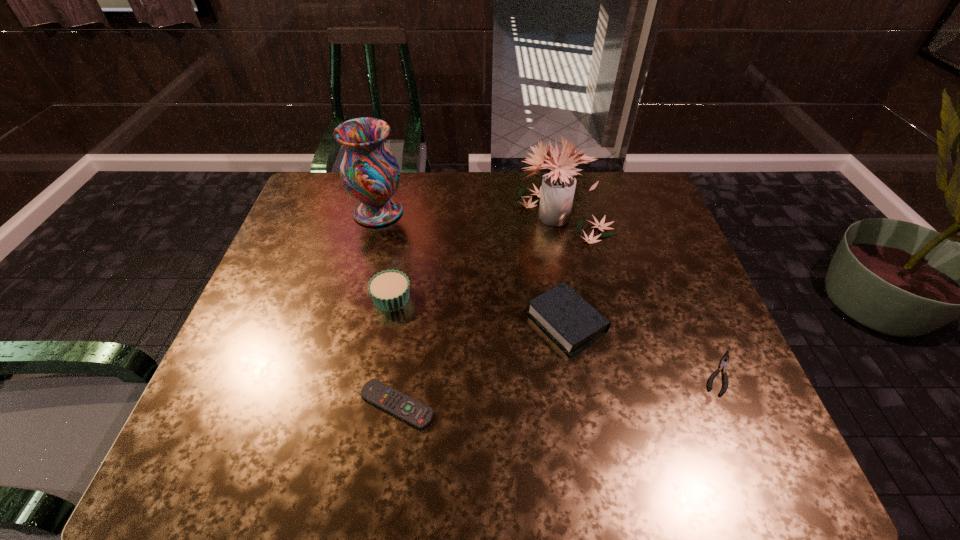
Locate an element on the screen. The height and width of the screenshot is (540, 960). blank region between the cupcake and the vase is located at coordinates (385, 255).

Select which object appears as the closest to the vase. Please provide its 2D coordinates. Your answer should be formatted as a tuple, i.e. [(x, y)], where the tuple contains the x and y coordinates of a point satisfying the conditions above.

[(389, 290)]

Locate an element on the screen. object that stands as the second closest to the third shortest object is located at coordinates click(x=724, y=362).

Locate an element on the screen. The height and width of the screenshot is (540, 960). free space that satisfies the following two spatial constraints: 1. on the front side of the vase; 2. on the right side of the bouquet is located at coordinates (377, 216).

Where is `vacant point that satisfies the following two spatial constraints: 1. on the back side of the pliers; 2. on the right side of the remote control`? Image resolution: width=960 pixels, height=540 pixels. vacant point that satisfies the following two spatial constraints: 1. on the back side of the pliers; 2. on the right side of the remote control is located at coordinates (401, 373).